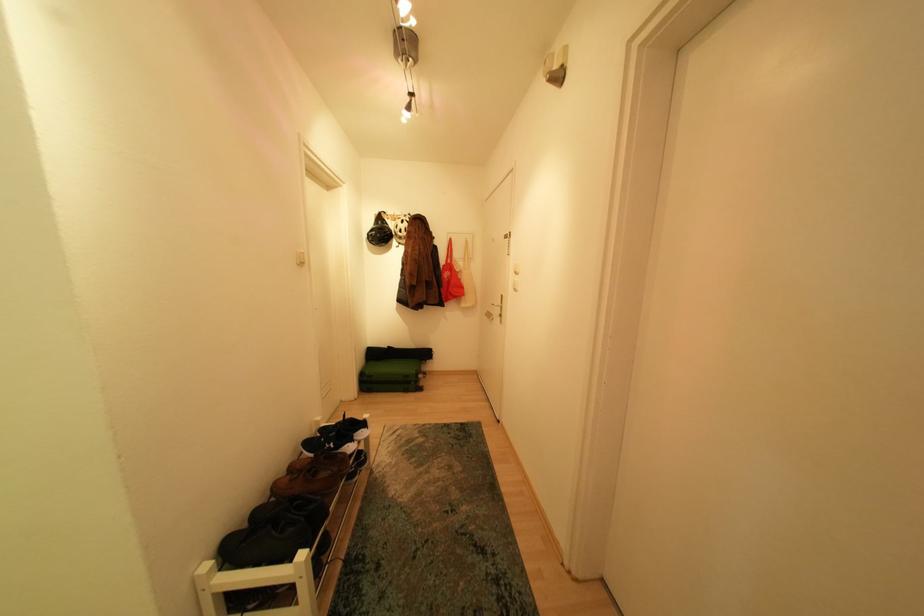
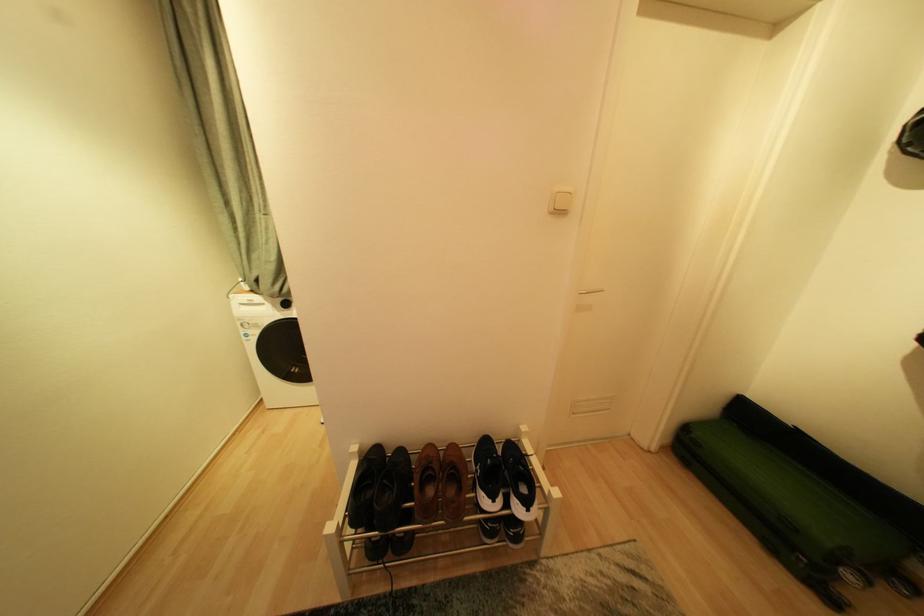
Find the pixel in the second image that matches (x=427, y=391) in the first image.

(834, 599)